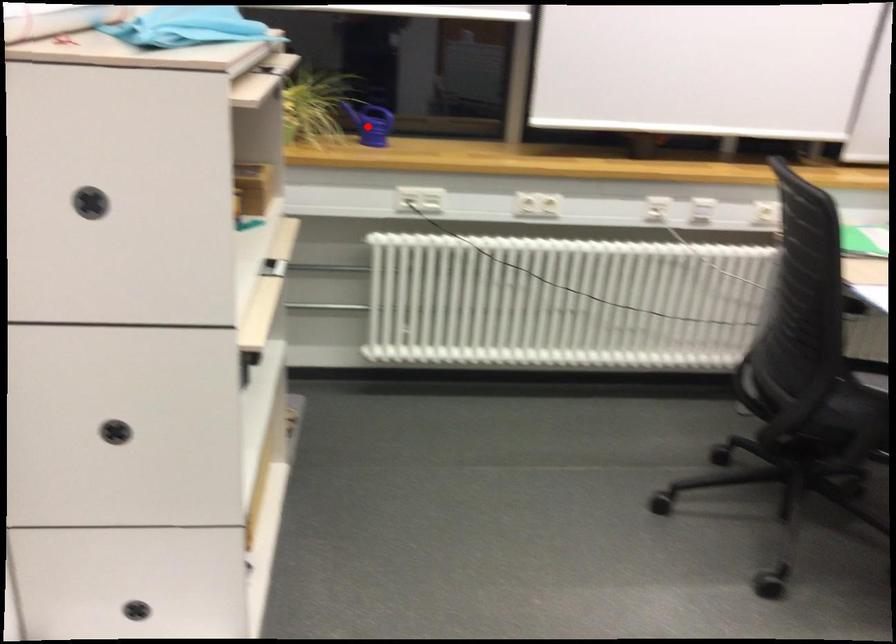
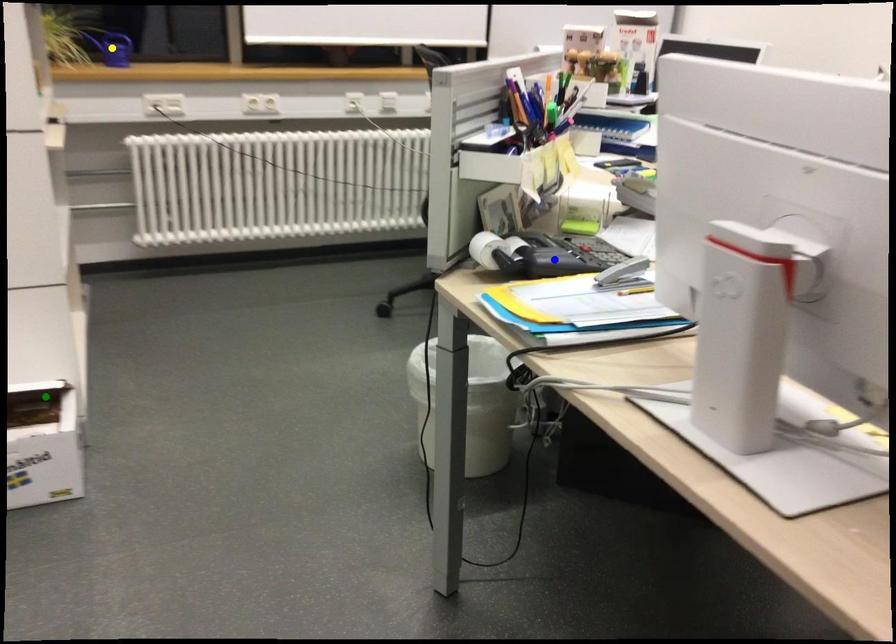
Question: I am providing you with two images of the same scene from different viewpoints. A red point is marked on the first image. You are given multiple points on the second image. Which point in image 2 represents the same 3d spot as the red point in image 1?

Choices:
 (A) blue point
 (B) yellow point
 (C) green point

Answer: (B)